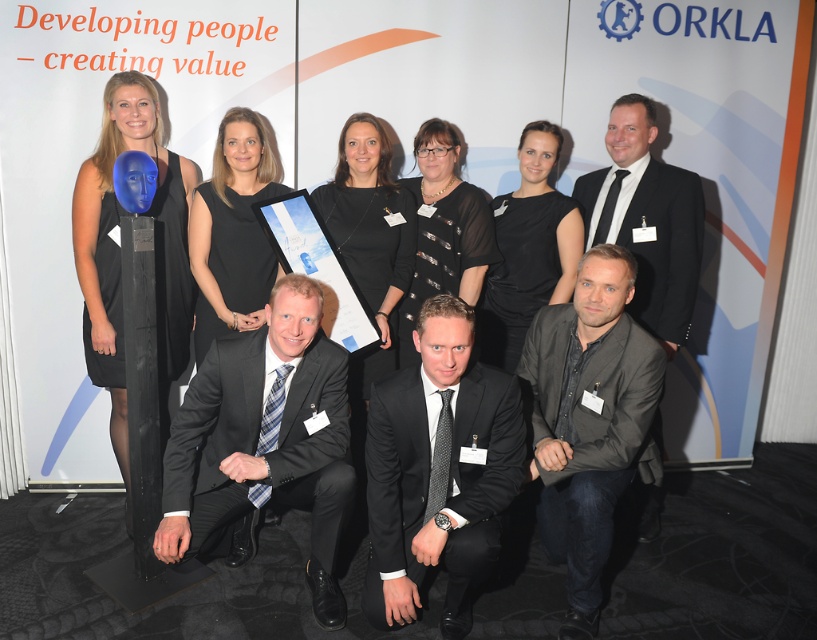
Looking at this image, is blue matte mask at upper center taller than black sheer dress at center?

In fact, blue matte mask at upper center may be shorter than black sheer dress at center.

Is blue matte mask at upper center below black sheer dress at center?

Incorrect, blue matte mask at upper center is not positioned below black sheer dress at center.

Is point (253, 314) in front of point (429, 262)?

Yes, it is in front of point (429, 262).

This screenshot has height=640, width=817. In order to click on blue matte mask at upper center in this screenshot , I will do `click(231, 230)`.

Is black suit at center to the left of blue matte mask at upper center from the viewer's perspective?

No, black suit at center is not to the left of blue matte mask at upper center.

From the picture: Who is positioned more to the left, black suit at center or blue matte mask at upper center?

Positioned to the left is blue matte mask at upper center.

Is point (249, 385) farther from camera compared to point (266, 180)?

No, it is in front of (266, 180).

This screenshot has height=640, width=817. What are the coordinates of `black suit at center` in the screenshot? It's located at (264, 440).

Which is in front, point (592, 312) or point (217, 161)?

Point (592, 312) is more forward.

At what (x,y) coordinates should I click in order to perform the action: click on dark gray suit at lower right. Please return your answer as a coordinate pair (x, y). The image size is (817, 640). Looking at the image, I should click on (588, 420).